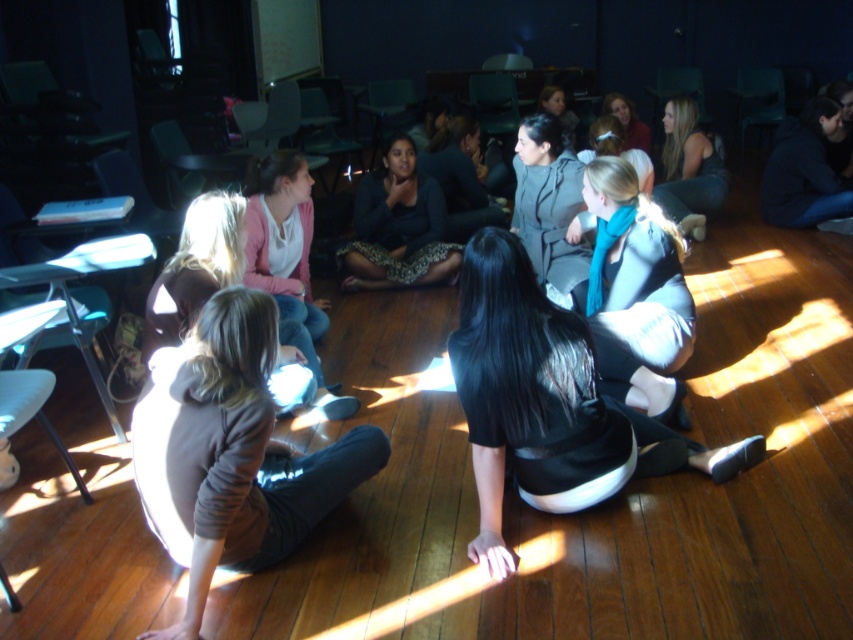
Question: Can you confirm if blue scarf at center is bigger than matte gray hoodie at center?

Choices:
 (A) yes
 (B) no

Answer: (B)

Question: Does black matte skirt at center come in front of matte gray hoodie at center?

Choices:
 (A) no
 (B) yes

Answer: (B)

Question: Which of the following is the farthest from the observer?

Choices:
 (A) blue scarf at center
 (B) matte gray hoodie at center

Answer: (B)

Question: Does black matte skirt at center have a larger size compared to blue scarf at center?

Choices:
 (A) no
 (B) yes

Answer: (B)

Question: Which point is closer to the camera?

Choices:
 (A) matte gray hoodie at upper center
 (B) matte gray hoodie at center

Answer: (B)

Question: Which of the following is the closest to the observer?

Choices:
 (A) matte gray hoodie at center
 (B) black matte skirt at center
 (C) matte gray hoodie at upper center

Answer: (B)